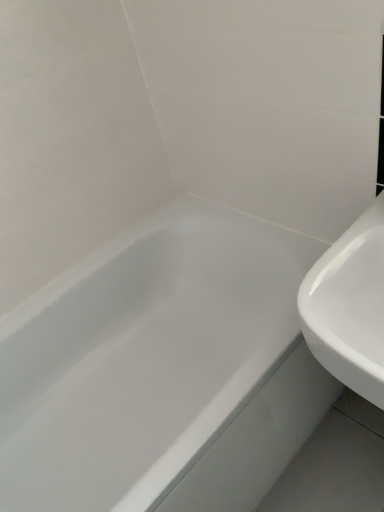
Question: Could you tell me if white glossy bathtub at center is turned towards white glossy sink at right?

Choices:
 (A) no
 (B) yes

Answer: (A)

Question: Would you say white glossy bathtub at center contains white glossy sink at right?

Choices:
 (A) yes
 (B) no

Answer: (B)

Question: Does white glossy bathtub at center appear on the left side of white glossy sink at right?

Choices:
 (A) yes
 (B) no

Answer: (A)

Question: From the image's perspective, is white glossy bathtub at center located beneath white glossy sink at right?

Choices:
 (A) yes
 (B) no

Answer: (A)

Question: Is white glossy bathtub at center further to camera compared to white glossy sink at right?

Choices:
 (A) yes
 (B) no

Answer: (A)

Question: From the image's perspective, does white glossy bathtub at center appear higher than white glossy sink at right?

Choices:
 (A) yes
 (B) no

Answer: (B)

Question: Would you say white glossy bathtub at center is part of white glossy sink at right's contents?

Choices:
 (A) no
 (B) yes

Answer: (A)

Question: Are white glossy sink at right and white glossy bathtub at center located far from each other?

Choices:
 (A) yes
 (B) no

Answer: (B)

Question: Does white glossy sink at right lie in front of white glossy bathtub at center?

Choices:
 (A) no
 (B) yes

Answer: (B)

Question: Considering the relative sizes of white glossy sink at right and white glossy bathtub at center in the image provided, is white glossy sink at right thinner than white glossy bathtub at center?

Choices:
 (A) no
 (B) yes

Answer: (B)

Question: From the image's perspective, is white glossy sink at right located beneath white glossy bathtub at center?

Choices:
 (A) yes
 (B) no

Answer: (B)

Question: Is white glossy sink at right looking in the opposite direction of white glossy bathtub at center?

Choices:
 (A) yes
 (B) no

Answer: (B)

Question: Looking at their shapes, would you say white glossy bathtub at center is wider or thinner than white glossy sink at right?

Choices:
 (A) thin
 (B) wide

Answer: (B)